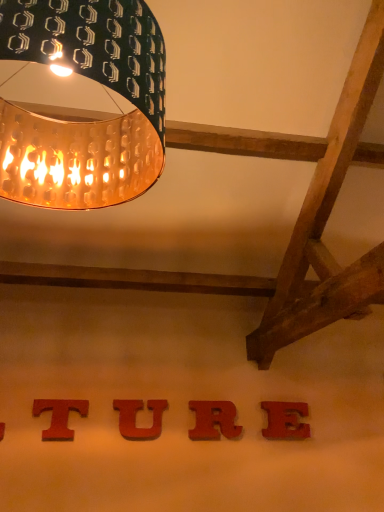
Question: In which direction should I rotate to look at red wood letter t at lower center, placed as the fourth alphabet when sorted from right to left?

Choices:
 (A) right
 (B) left

Answer: (B)

Question: Would you say red wood u at center, the second alphabet in the left-to-right sequence, is outside gold perforated lampshade at upper left?

Choices:
 (A) no
 (B) yes

Answer: (B)

Question: Can you confirm if red wood u at center, placed as the 3th alphabet when sorted from right to left, is thinner than gold perforated lampshade at upper left?

Choices:
 (A) yes
 (B) no

Answer: (A)

Question: Is red wood u at center, placed as the 3th alphabet when sorted from right to left, taller than gold perforated lampshade at upper left?

Choices:
 (A) yes
 (B) no

Answer: (B)

Question: Does red wood u at center, the second alphabet in the left-to-right sequence, have a larger size compared to gold perforated lampshade at upper left?

Choices:
 (A) yes
 (B) no

Answer: (B)

Question: Is the position of red wood u at center, placed as the 3th alphabet when sorted from right to left, less distant than that of gold perforated lampshade at upper left?

Choices:
 (A) no
 (B) yes

Answer: (A)

Question: From a real-world perspective, is red wood u at center, the second alphabet in the left-to-right sequence, located higher than gold perforated lampshade at upper left?

Choices:
 (A) yes
 (B) no

Answer: (B)

Question: Is red wood u at center, the second alphabet in the left-to-right sequence, at the back of red matte letter e at center, marked as the first alphabet in a right-to-left arrangement?

Choices:
 (A) yes
 (B) no

Answer: (B)

Question: Is red matte letter e at center, the 4th alphabet viewed from the left, outside red wood u at center, the second alphabet in the left-to-right sequence?

Choices:
 (A) yes
 (B) no

Answer: (A)

Question: Considering the relative positions of red matte letter e at center, the 4th alphabet viewed from the left, and red wood u at center, placed as the 3th alphabet when sorted from right to left, in the image provided, is red matte letter e at center, the 4th alphabet viewed from the left, to the left of red wood u at center, placed as the 3th alphabet when sorted from right to left, from the viewer's perspective?

Choices:
 (A) yes
 (B) no

Answer: (B)

Question: Considering the relative sizes of red matte letter e at center, marked as the first alphabet in a right-to-left arrangement, and red wood u at center, placed as the 3th alphabet when sorted from right to left, in the image provided, is red matte letter e at center, marked as the first alphabet in a right-to-left arrangement, smaller than red wood u at center, placed as the 3th alphabet when sorted from right to left,?

Choices:
 (A) yes
 (B) no

Answer: (B)

Question: Is red matte letter e at center, the 4th alphabet viewed from the left, placed right next to red wood u at center, placed as the 3th alphabet when sorted from right to left?

Choices:
 (A) no
 (B) yes

Answer: (A)

Question: Is the position of red matte letter e at center, the 4th alphabet viewed from the left, less distant than that of red wood u at center, the second alphabet in the left-to-right sequence?

Choices:
 (A) yes
 (B) no

Answer: (B)

Question: From the image's perspective, is red matte letter r at center, which ranks as the third alphabet in left-to-right order, under red matte letter e at center, marked as the first alphabet in a right-to-left arrangement?

Choices:
 (A) no
 (B) yes

Answer: (A)